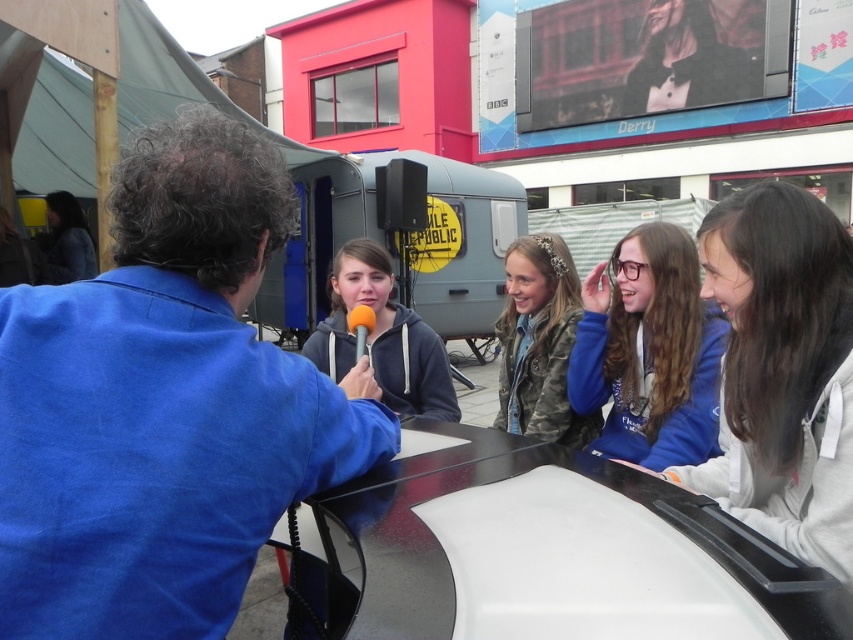
The width and height of the screenshot is (853, 640). What do you see at coordinates (550, 552) in the screenshot? I see `black polished table at lower center` at bounding box center [550, 552].

Who is taller, black polished table at lower center or light gray hoodie at right?

light gray hoodie at right

Identify the location of black polished table at lower center. click(x=550, y=552).

Locate an element on the screen. Image resolution: width=853 pixels, height=640 pixels. black polished table at lower center is located at coordinates (550, 552).

Which is more to the left, light gray hoodie at right or matte gray hoodie at center?

matte gray hoodie at center is more to the left.

Can you confirm if light gray hoodie at right is bigger than matte gray hoodie at center?

No, light gray hoodie at right is not bigger than matte gray hoodie at center.

This screenshot has height=640, width=853. Identify the location of light gray hoodie at right. (782, 371).

Who is higher up, black polished table at lower center or blue fleece jacket at center?

blue fleece jacket at center is higher up.

Which is more to the right, black polished table at lower center or blue fleece jacket at center?

From the viewer's perspective, blue fleece jacket at center appears more on the right side.

Which is behind, point (831, 628) or point (682, 324)?

The point (682, 324) is behind.

This screenshot has height=640, width=853. Identify the location of black polished table at lower center. (550, 552).